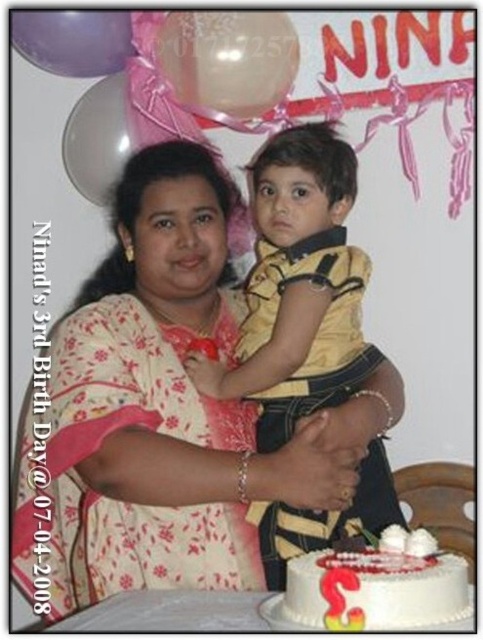
You are a photographer at Nina s birthday party and need to decide which clothing item to focus on for the next shot. The floral fabric dress at center and the yellow smooth shirt at center are both in the frame. Which one is larger in size?

The floral fabric dress at center is bigger than the yellow smooth shirt at center, so the photographer should focus on the floral fabric dress at center for the next shot as it is larger in size.